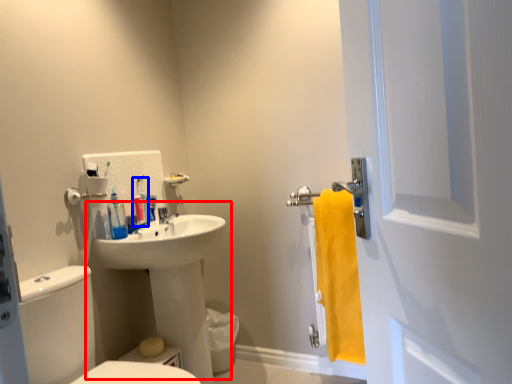
Question: Which point is further to the camera, sink (highlighted by a red box) or toiletry (highlighted by a blue box)?

Choices:
 (A) sink
 (B) toiletry

Answer: (B)